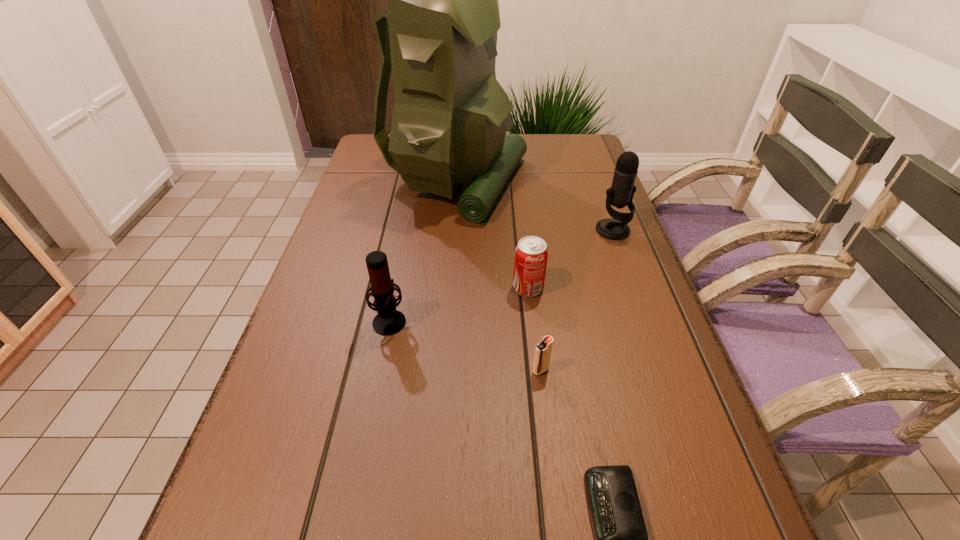
Where is `backpack`? The image size is (960, 540). backpack is located at coordinates (450, 118).

The width and height of the screenshot is (960, 540). What are the coordinates of `the second tallest object` in the screenshot? It's located at (621, 193).

Where is `the farther microphone`? Image resolution: width=960 pixels, height=540 pixels. the farther microphone is located at coordinates (621, 193).

I want to click on the left microphone, so click(x=388, y=321).

At what (x,y) coordinates should I click in order to perform the action: click on the nearer microphone. Please return your answer as a coordinate pair (x, y). Image resolution: width=960 pixels, height=540 pixels. Looking at the image, I should click on (388, 321).

Identify the location of soda can. (531, 254).

At what (x,y) coordinates should I click in order to perform the action: click on the fourth nearest object. Please return your answer as a coordinate pair (x, y). This screenshot has width=960, height=540. Looking at the image, I should click on (531, 254).

Locate an element on the screen. This screenshot has width=960, height=540. igniter is located at coordinates (543, 349).

Find the location of a particular element. The height and width of the screenshot is (540, 960). the second shortest object is located at coordinates (543, 349).

Image resolution: width=960 pixels, height=540 pixels. Find the location of `vacant region located 0.190m on the front of the backpack with visible pockets`. vacant region located 0.190m on the front of the backpack with visible pockets is located at coordinates (594, 181).